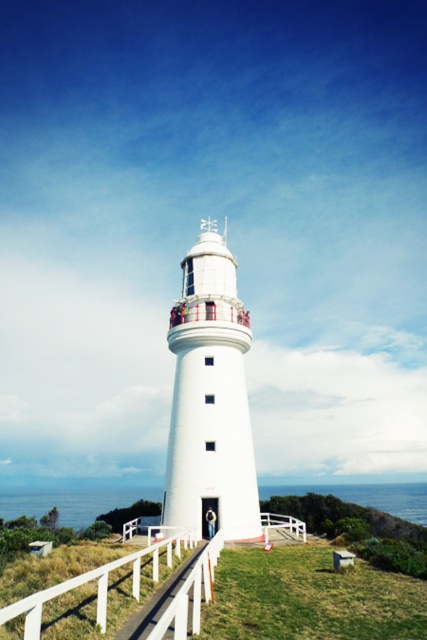
Question: Which of the following is the closest to the observer?

Choices:
 (A) white wooden rail at center
 (B) white smooth lighthouse at center

Answer: (A)

Question: Is white smooth lighthouse at center smaller than white wooden rail at center?

Choices:
 (A) no
 (B) yes

Answer: (A)

Question: Which point is closer to the camera?

Choices:
 (A) white wooden rail at center
 (B) white smooth lighthouse at center

Answer: (A)

Question: Where is white smooth lighthouse at center located in relation to white wooden rail at center in the image?

Choices:
 (A) right
 (B) left

Answer: (A)

Question: Which object is closer to the camera taking this photo?

Choices:
 (A) white wooden rail at center
 (B) white smooth lighthouse at center

Answer: (A)

Question: Does white smooth lighthouse at center appear on the left side of white wooden rail at center?

Choices:
 (A) yes
 (B) no

Answer: (B)